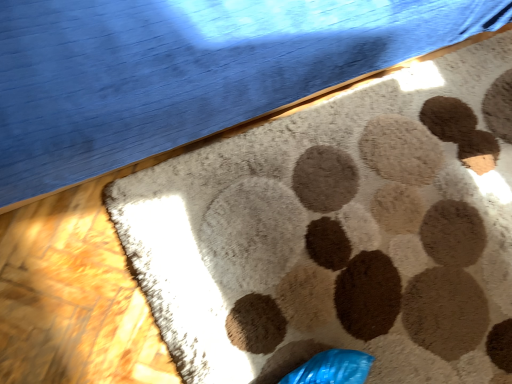
Question: From the image's perspective, is beige carpet at center positioned above or below beige textured rug at center?

Choices:
 (A) above
 (B) below

Answer: (A)

Question: Is point (142, 6) closer or farther from the camera than point (192, 196)?

Choices:
 (A) closer
 (B) farther

Answer: (A)

Question: Choose the correct answer: Is beige carpet at center inside beige textured rug at center or outside it?

Choices:
 (A) inside
 (B) outside

Answer: (B)

Question: Is point (318, 312) positioned closer to the camera than point (482, 8)?

Choices:
 (A) farther
 (B) closer

Answer: (B)

Question: From a real-world perspective, is beige textured rug at center physically located above or below beige carpet at center?

Choices:
 (A) above
 (B) below

Answer: (B)

Question: In the image, is beige textured rug at center on the left side or the right side of beige carpet at center?

Choices:
 (A) left
 (B) right

Answer: (B)

Question: Is beige textured rug at center wider or thinner than beige carpet at center?

Choices:
 (A) wide
 (B) thin

Answer: (A)